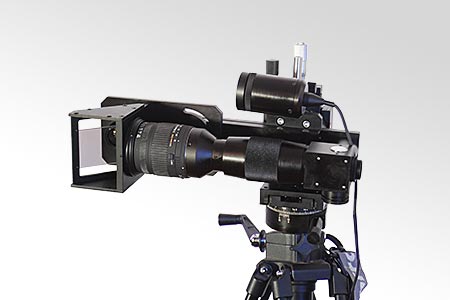
You are a GUI agent. You are given a task and a screenshot of the screen. Output one action in this format:
    pyautogui.click(x=<x>, y=<y>)
    Task: Click on the illuminator power cord
    
    Given the screenshot: What is the action you would take?
    pyautogui.click(x=301, y=247), pyautogui.click(x=353, y=214)